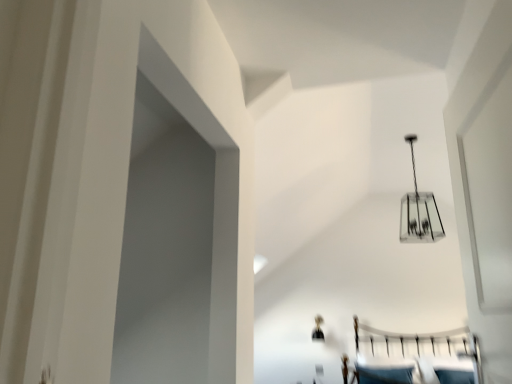
Question: Which direction should I rotate to look at clear glass chandelier at upper center, the first lamp from the bottom, — up or down?

Choices:
 (A) down
 (B) up

Answer: (A)

Question: Is clear glass chandelier at upper center, the 2th lamp when ordered from front to back, wider than clear glass chandelier at upper center, which is the 2th lamp in back-to-front order?

Choices:
 (A) no
 (B) yes

Answer: (A)

Question: From the image's perspective, does clear glass chandelier at upper center, which appears as the 1th lamp when viewed from the back, appear lower than clear glass chandelier at upper center, which appears as the second lamp when viewed from the left?

Choices:
 (A) yes
 (B) no

Answer: (A)

Question: Is the depth of clear glass chandelier at upper center, which appears as the 1th lamp when viewed from the back, greater than that of clear glass chandelier at upper center, which is the 2th lamp in back-to-front order?

Choices:
 (A) yes
 (B) no

Answer: (A)

Question: Does clear glass chandelier at upper center, which ranks as the second lamp in top-to-bottom order, appear on the left side of clear glass chandelier at upper center, placed as the first lamp when sorted from top to bottom?

Choices:
 (A) yes
 (B) no

Answer: (A)

Question: Is clear glass chandelier at upper center, which ranks as the second lamp in top-to-bottom order, taller than clear glass chandelier at upper center, arranged as the 1th lamp when viewed from the front?

Choices:
 (A) yes
 (B) no

Answer: (B)

Question: Is clear glass chandelier at upper center, which appears as the 1th lamp when viewed from the back, positioned far away from clear glass chandelier at upper center, placed as the first lamp when sorted from top to bottom?

Choices:
 (A) yes
 (B) no

Answer: (A)

Question: From a real-world perspective, is clear glass chandelier at upper center, which is the 2th lamp in back-to-front order, physically above clear glass chandelier at upper center, which ranks as the second lamp in top-to-bottom order?

Choices:
 (A) yes
 (B) no

Answer: (A)

Question: Can you confirm if clear glass chandelier at upper center, which is the 2th lamp in back-to-front order, is thinner than clear glass chandelier at upper center, which is the 2th lamp in right-to-left order?

Choices:
 (A) no
 (B) yes

Answer: (A)

Question: Is clear glass chandelier at upper center, which appears as the first lamp when viewed from the left, at the back of clear glass chandelier at upper center, which appears as the second lamp when viewed from the left?

Choices:
 (A) no
 (B) yes

Answer: (A)

Question: Is clear glass chandelier at upper center, arranged as the 1th lamp when viewed from the front, directly adjacent to clear glass chandelier at upper center, which is the 2th lamp in right-to-left order?

Choices:
 (A) yes
 (B) no

Answer: (B)

Question: Is clear glass chandelier at upper center, marked as the first lamp in a right-to-left arrangement, in front of clear glass chandelier at upper center, which appears as the 1th lamp when viewed from the back?

Choices:
 (A) no
 (B) yes

Answer: (B)

Question: Is clear glass chandelier at upper center, placed as the first lamp when sorted from top to bottom, outside clear glass chandelier at upper center, which appears as the 1th lamp when viewed from the back?

Choices:
 (A) yes
 (B) no

Answer: (A)

Question: In the image, is clear glass chandelier at upper center, the first lamp from the bottom, positioned in front of or behind clear glass chandelier at upper center, which is the 2th lamp in back-to-front order?

Choices:
 (A) front
 (B) behind

Answer: (B)